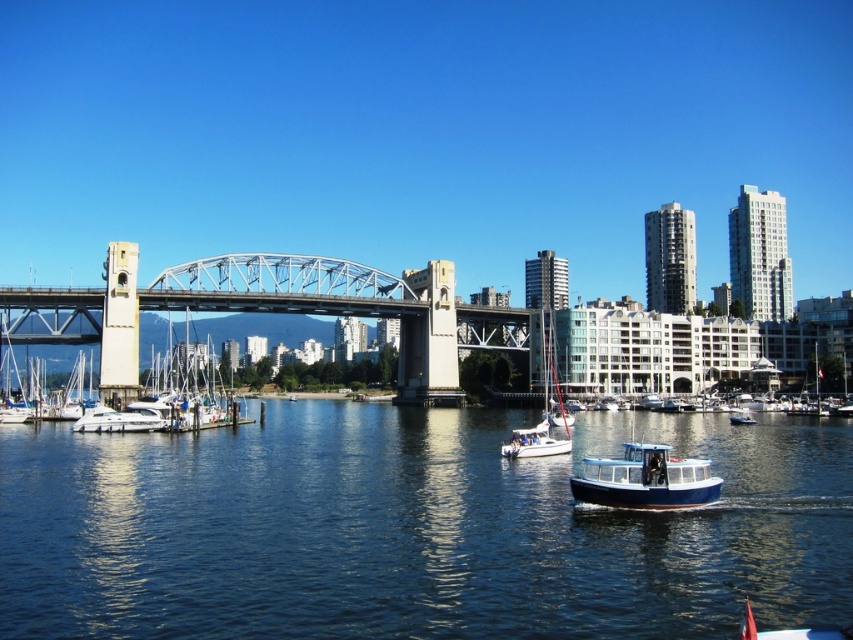
You are standing on the dock and see the blue polished wood boat at center. If you want to throw a lifebuoy to someone on the boat, and the lifebuoy can travel 50 meters, will it reach them?

The distance between you and the blue polished wood boat at center is 48.94 meters, so yes, the lifebuoy can reach them since it is within the 50 meters range.

You are a photographer planning to capture both the blue polished wood boat at center and the white glossy boat at lower left in a single shot. Based on their positions, which boat should you focus on first to ensure both are in frame?

The blue polished wood boat at center is located below the white glossy boat at lower left, so focusing on the white glossy boat at lower left first will allow you to adjust the camera angle downward to include the blue polished wood boat at center in the frame.